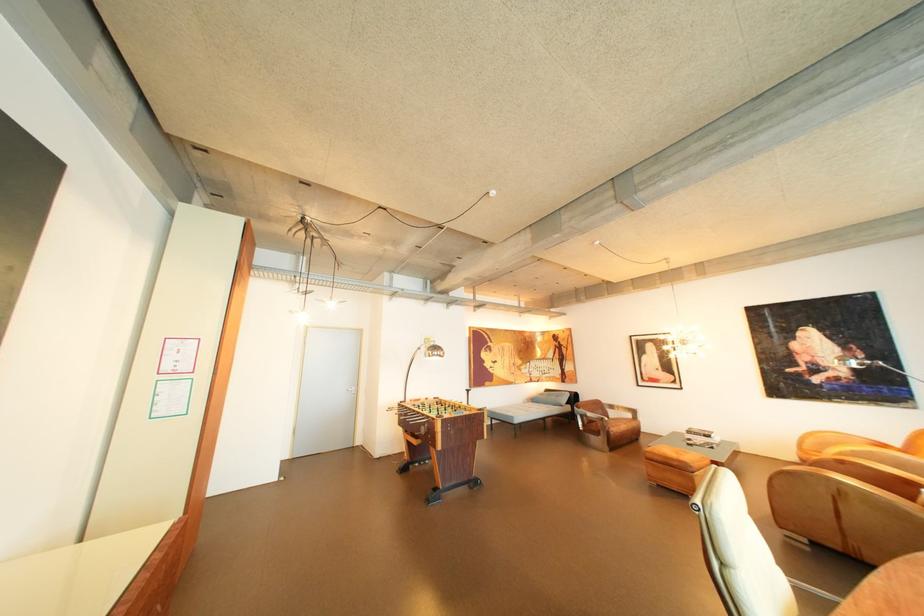
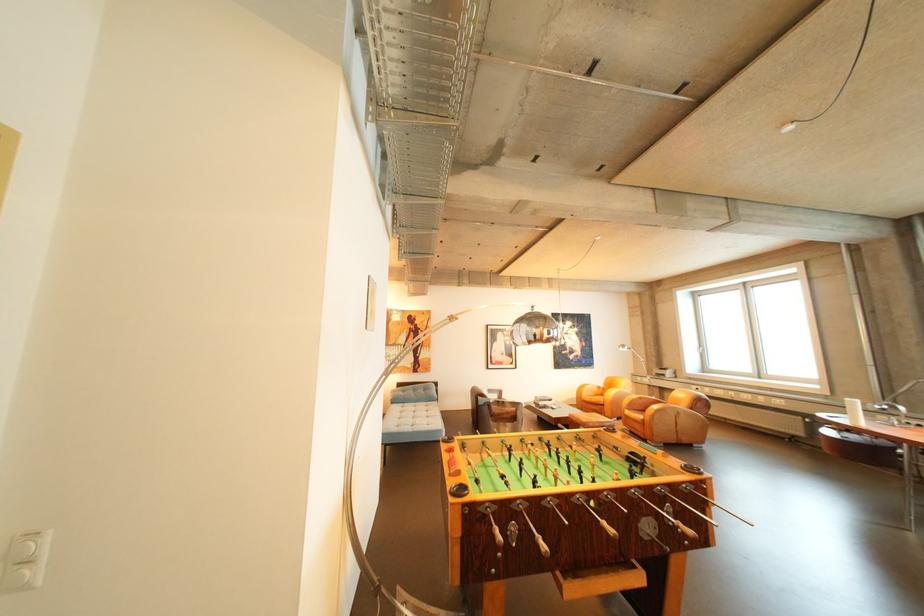
Find the pixel in the second image that matches (824,436) in the first image.

(594, 387)